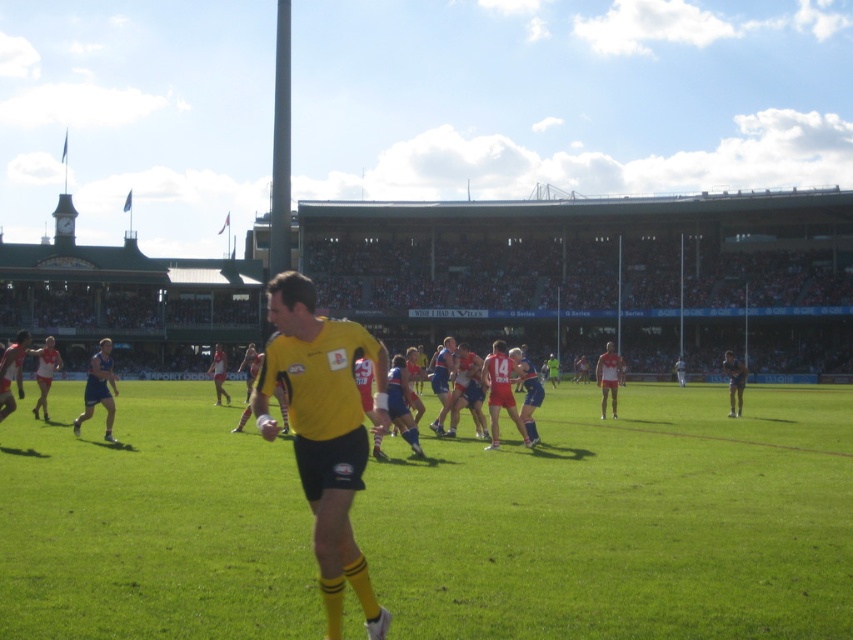
Who is taller, yellow matte jersey at center or blue uniform at center?

With more height is yellow matte jersey at center.

Is yellow matte jersey at center below blue uniform at center?

Actually, yellow matte jersey at center is above blue uniform at center.

Which is in front, point (305, 301) or point (111, 433)?

Point (305, 301) is more forward.

The width and height of the screenshot is (853, 640). I want to click on yellow matte jersey at center, so click(x=323, y=432).

How much distance is there between yellow matte jersey at center and blue jersey at center?

They are 49.31 feet apart.

Which is in front, point (309, 499) or point (445, 337)?

Positioned in front is point (309, 499).

Between point (328, 330) and point (445, 358), which one is positioned in front?

Point (328, 330) is more forward.

Identify the location of yellow matte jersey at center. The image size is (853, 640). (323, 432).

How far apart are blue jersey at center and matte blue shorts at right?

12.87 meters

Between blue jersey at center and matte blue shorts at right, which one appears on the left side from the viewer's perspective?

blue jersey at center is more to the left.

Is point (436, 396) behind point (740, 362)?

No, it is not.

The width and height of the screenshot is (853, 640). Find the location of `blue jersey at center`. blue jersey at center is located at coordinates (442, 380).